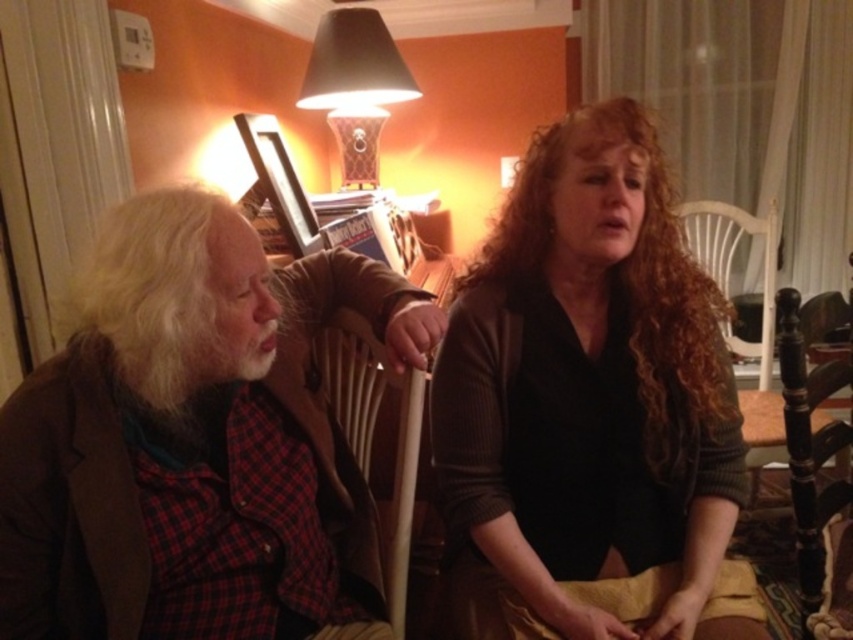
Question: Which of these objects is positioned closest to the dark brown sweater at center?

Choices:
 (A) plaid fabric shirt at left
 (B) matte black lampshade at upper center

Answer: (A)

Question: Can you confirm if plaid fabric shirt at left is thinner than wooden chair at center?

Choices:
 (A) yes
 (B) no

Answer: (B)

Question: Is plaid fabric shirt at left above wooden chair at center?

Choices:
 (A) yes
 (B) no

Answer: (A)

Question: Is plaid fabric shirt at left closer to the viewer compared to wooden chair at center?

Choices:
 (A) no
 (B) yes

Answer: (B)

Question: Among these objects, which one is nearest to the camera?

Choices:
 (A) wooden chair at center
 (B) dark brown sweater at center

Answer: (B)

Question: Among these points, which one is farthest from the camera?

Choices:
 (A) (398, 445)
 (B) (218, 324)
 (C) (589, 282)

Answer: (C)